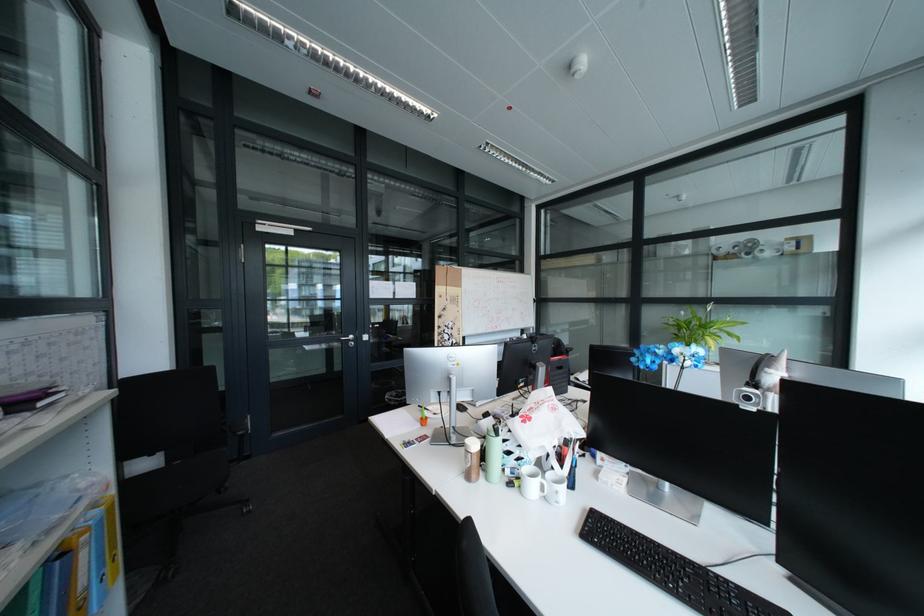
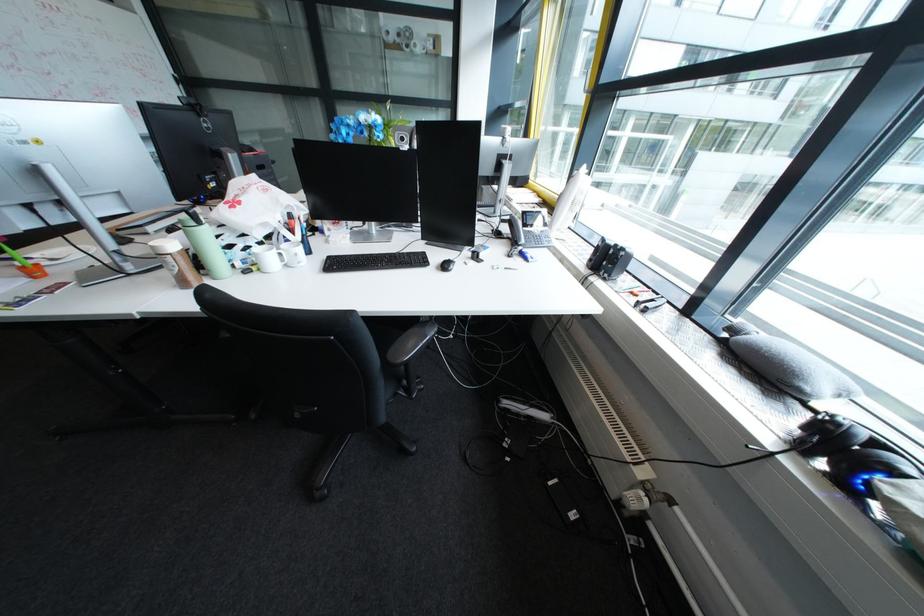
Locate, in the second image, the point that corresponds to point (496, 471) in the first image.

(217, 275)